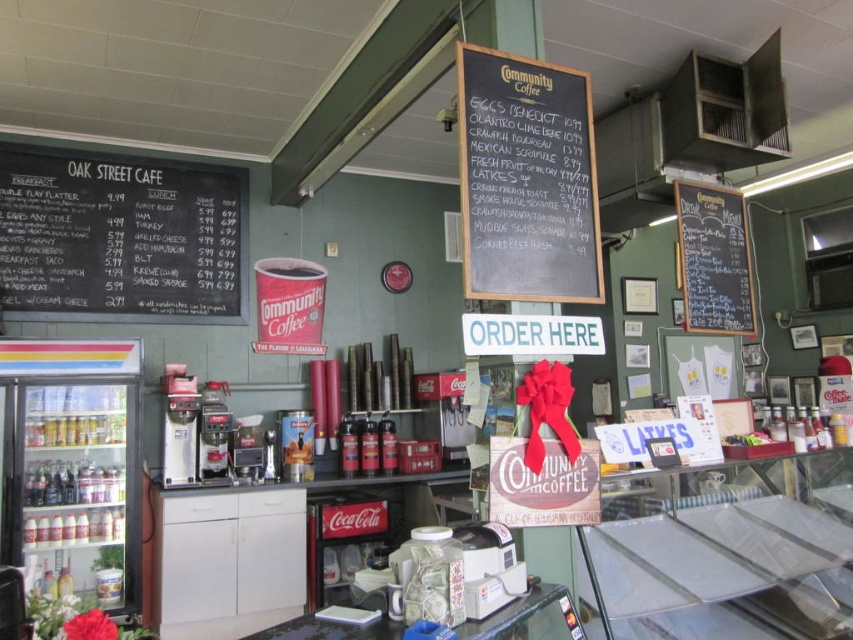
Question: Is black chalkboard menu at left closer to camera compared to black chalkboard at upper center?

Choices:
 (A) no
 (B) yes

Answer: (A)

Question: Which object is positioned closest to the black chalkboard at upper center?

Choices:
 (A) black chalkboard menu at left
 (B) black chalkboard menu at upper right

Answer: (B)

Question: Estimate the real-world distances between objects in this image. Which object is farther from the black chalkboard at upper center?

Choices:
 (A) black chalkboard menu at left
 (B) black chalkboard menu at upper right

Answer: (A)

Question: Which is farther from the black chalkboard menu at upper right?

Choices:
 (A) black chalkboard at upper center
 (B) black chalkboard menu at left

Answer: (B)

Question: Can you confirm if black chalkboard menu at left is smaller than black chalkboard at upper center?

Choices:
 (A) no
 (B) yes

Answer: (A)

Question: Is black chalkboard menu at left thinner than black chalkboard at upper center?

Choices:
 (A) no
 (B) yes

Answer: (A)